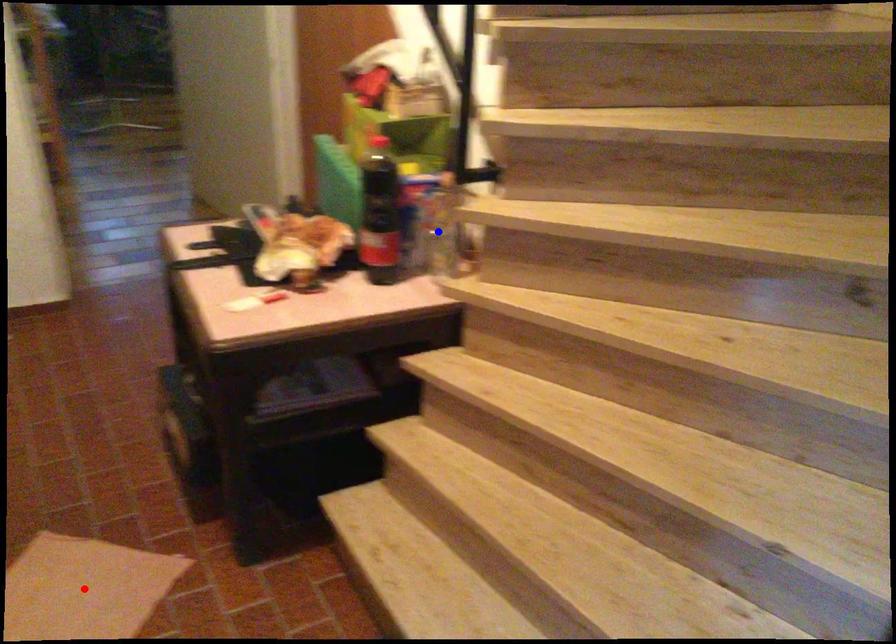
Question: Which of the two points in the image is closer to the camera?

Choices:
 (A) Blue point is closer.
 (B) Red point is closer.

Answer: (B)